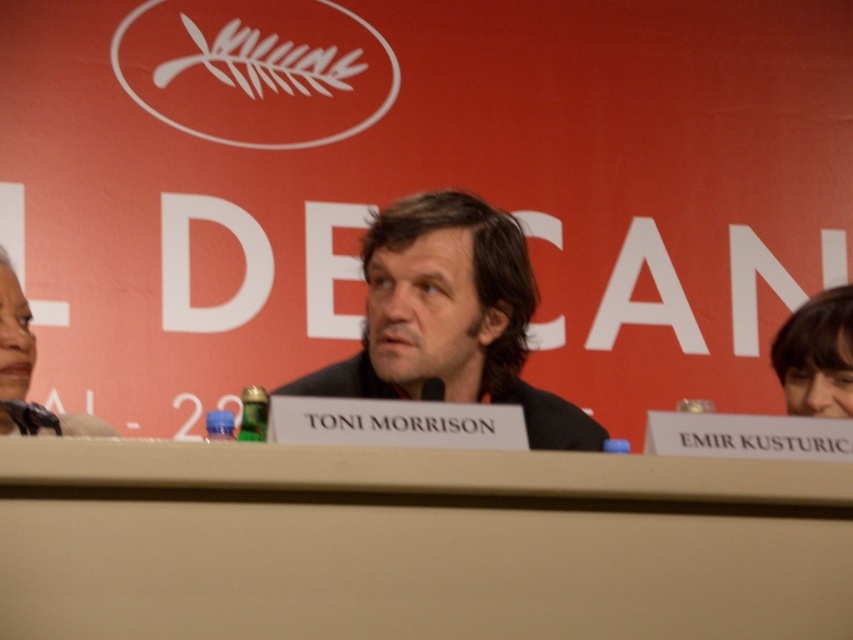
What do you see at coordinates (450, 317) in the screenshot? Image resolution: width=853 pixels, height=640 pixels. I see `dark brown hair at center` at bounding box center [450, 317].

Which is above, dark brown hair at center or smooth brown hair at upper right?

smooth brown hair at upper right

Identify the location of dark brown hair at center. (450, 317).

Which is behind, point (445, 243) or point (9, 292)?

The point (9, 292) is more distant.

Does dark brown hair at center have a greater width compared to matte black hair at left?

Yes.

Where is `dark brown hair at center`? The width and height of the screenshot is (853, 640). dark brown hair at center is located at coordinates (450, 317).

Find the location of a particular element. dark brown hair at center is located at coordinates (450, 317).

Is point (265, 582) more distant than point (799, 385)?

No, it is in front of (799, 385).

Is beige plastic table at center below smooth brown hair at upper right?

Correct, beige plastic table at center is located below smooth brown hair at upper right.

Where is `beige plastic table at center`? This screenshot has height=640, width=853. beige plastic table at center is located at coordinates (415, 544).